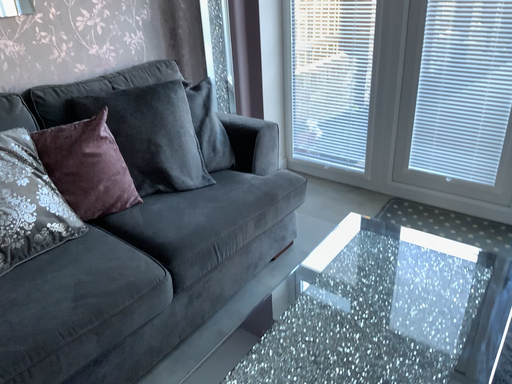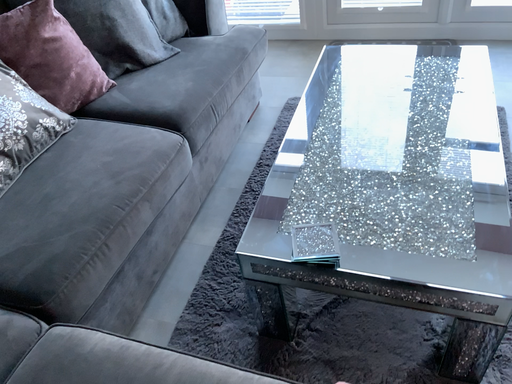
Question: Which way did the camera rotate in the video?

Choices:
 (A) rotated upward
 (B) rotated downward

Answer: (B)